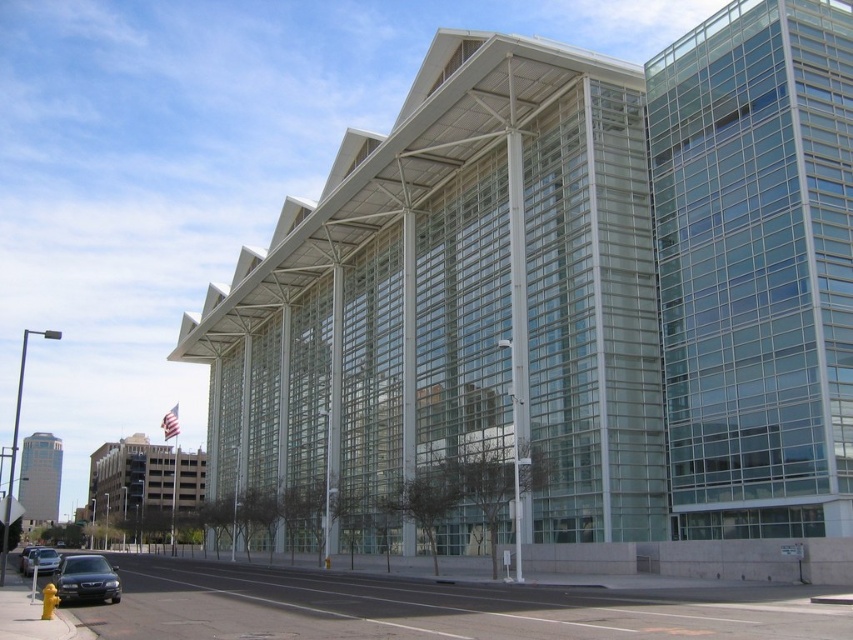
You are a delivery person trying to park your truck in the street near the convention center. You see two cars, a matte black sedan at lower left and a shiny black sedan at lower left. Which car is blocking your path if you want to park between them?

The matte black sedan at lower left is located above the shiny black sedan at lower left, so the shiny black sedan at lower left is lower and closer to the street. Therefore, the shiny black sedan at lower left is blocking the path between them.